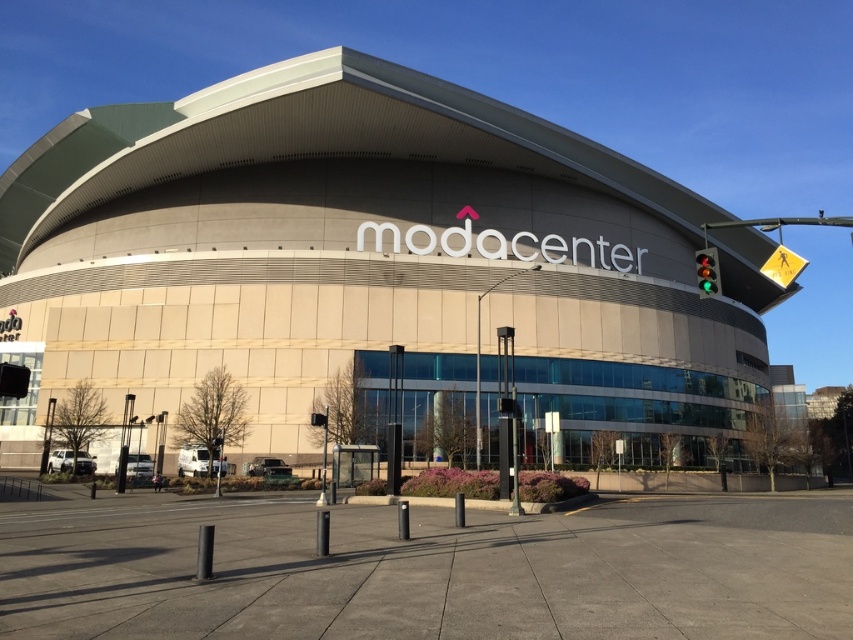
Does point (672, 348) come farther from viewer compared to point (717, 288)?

Yes, point (672, 348) is farther from viewer.

Can you confirm if beige/textured building at center is bigger than green glass traffic light at right?

Correct, beige/textured building at center is larger in size than green glass traffic light at right.

Who is more forward, (695, 401) or (701, 259)?

Positioned in front is point (701, 259).

Find the location of a particular element. beige/textured building at center is located at coordinates (370, 259).